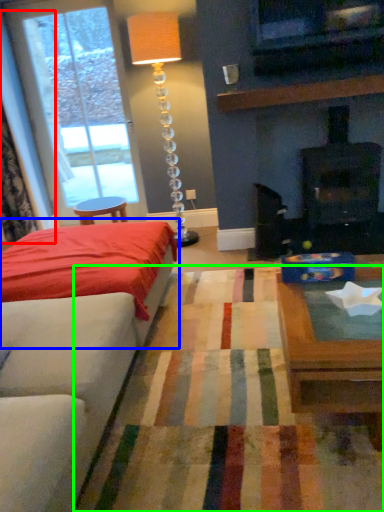
Question: Which object is the farthest from curtain (highlighted by a red box)? Choose among these: bed (highlighted by a blue box) or plain (highlighted by a green box).

Choices:
 (A) bed
 (B) plain

Answer: (B)